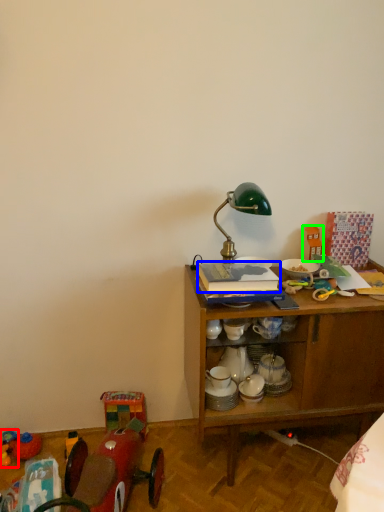
Question: Which object is the closest to the toy (highlighted by a red box)? Choose among these: book (highlighted by a blue box) or toy (highlighted by a green box).

Choices:
 (A) book
 (B) toy

Answer: (A)